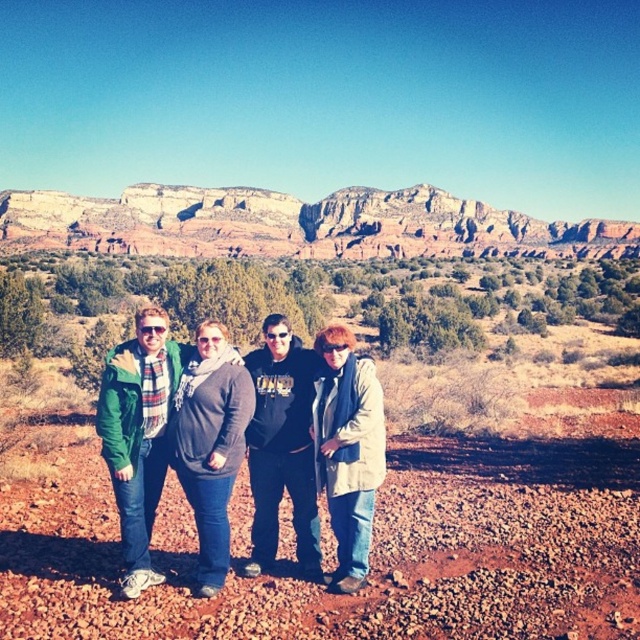
Question: Estimate the real-world distances between objects in this image. Which object is closer to the green plaid scarf at left?

Choices:
 (A) reddish-brown gravel at center
 (B) black matte hoodie at center

Answer: (B)

Question: Is reddish-brown gravel at center to the right of black matte hoodie at center from the viewer's perspective?

Choices:
 (A) yes
 (B) no

Answer: (A)

Question: Does green plaid scarf at left have a greater width compared to black matte hoodie at center?

Choices:
 (A) yes
 (B) no

Answer: (A)

Question: Which object is positioned closest to the reddish-brown gravel at center?

Choices:
 (A) green plaid scarf at left
 (B) black matte hoodie at center

Answer: (B)

Question: Considering the relative positions of reddish-brown gravel at center and green plaid scarf at left in the image provided, where is reddish-brown gravel at center located with respect to green plaid scarf at left?

Choices:
 (A) left
 (B) right

Answer: (B)

Question: Which is farther from the green plaid scarf at left?

Choices:
 (A) reddish-brown gravel at center
 (B) black matte hoodie at center

Answer: (A)